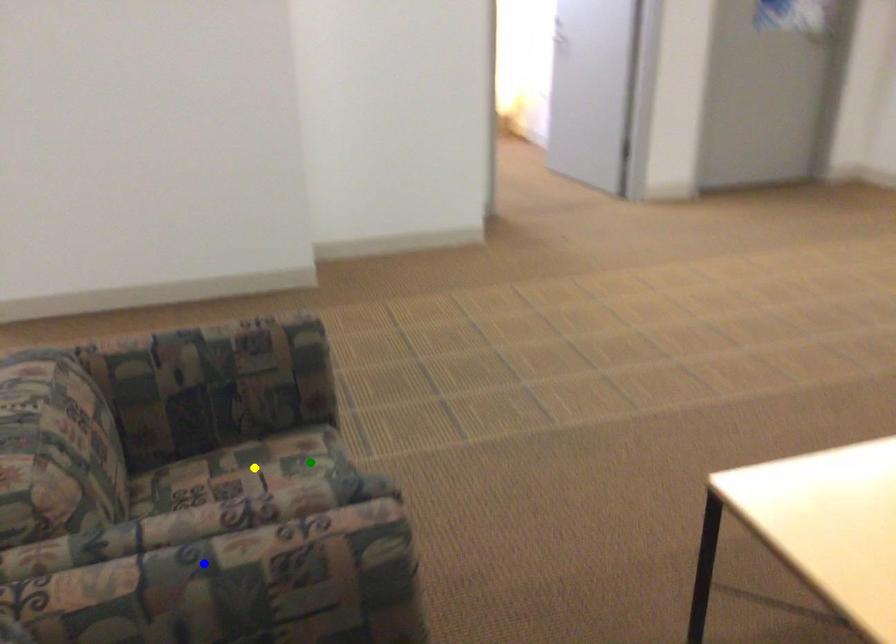
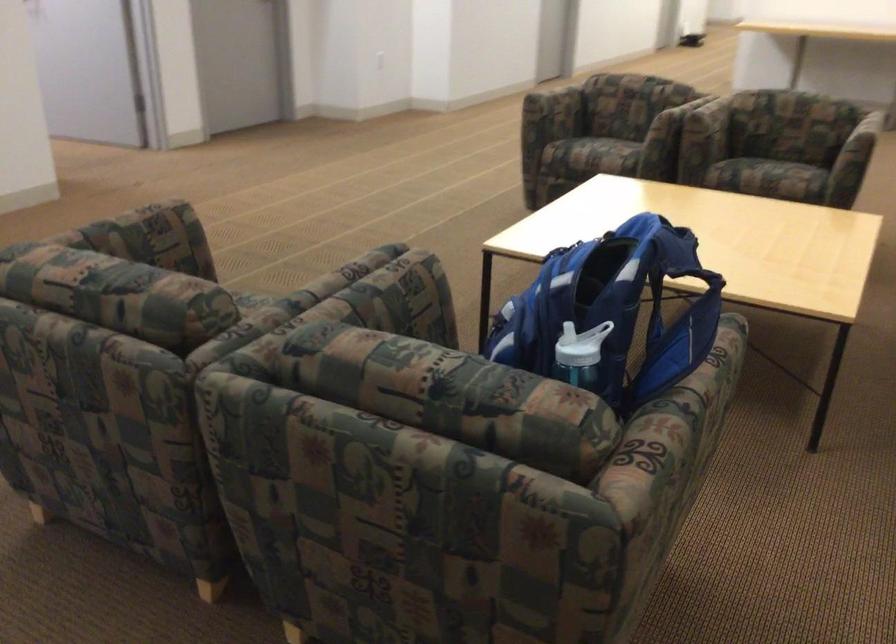
I am providing you with two images of the same scene from different viewpoints. Three points are marked in image1. Which point corresponds to a part or object that is occluded in image2?In image1, three points are marked. Which of them correspond to a part or object that is occluded in image2?Among the three points shown in image1, which one corresponds to a part or object that is no longer visible due to occlusion in image2?

yellow point cannot be seen in image2.